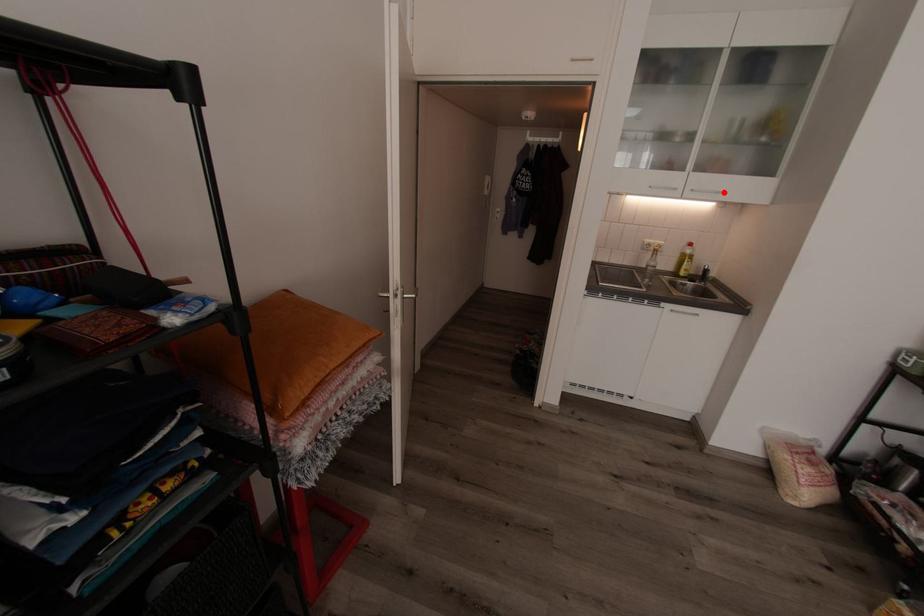
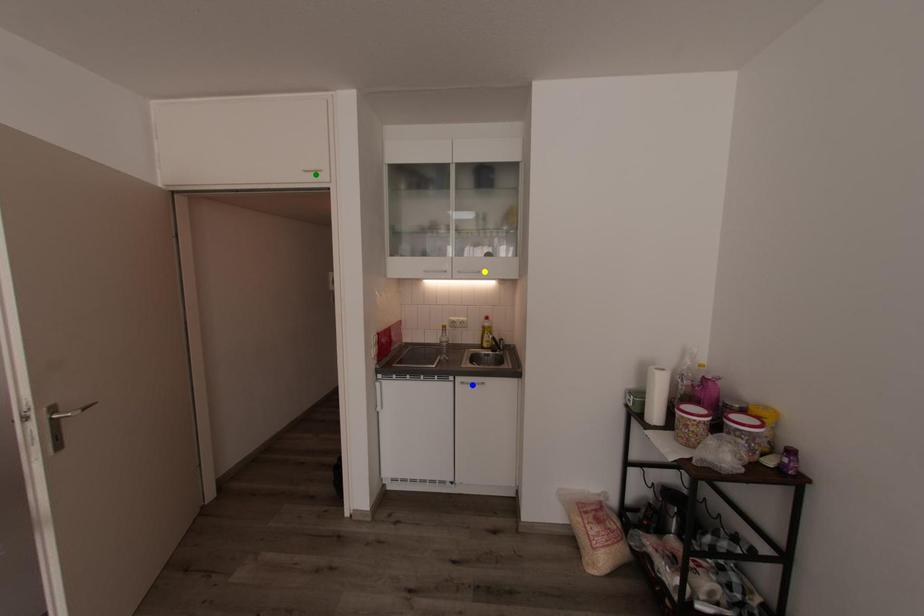
Question: I am providing you with two images of the same scene from different viewpoints. A red point is marked on the first image. You are given multiple points on the second image. Can you choose the point in image 2 that corresponds to the point in image 1?

Choices:
 (A) yellow point
 (B) blue point
 (C) green point

Answer: (A)